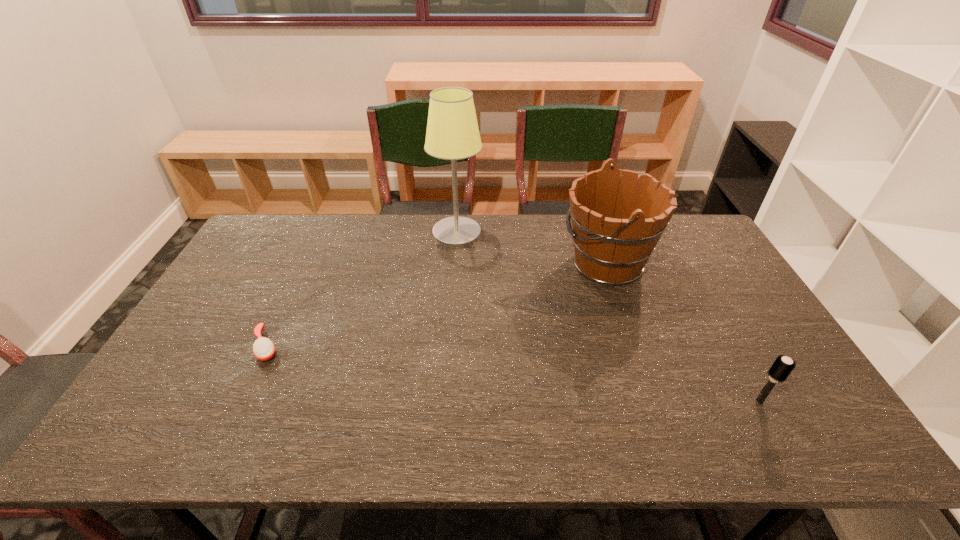
Where is `vacant space located 0.050m with the handle on the third object from left to right`? This screenshot has height=540, width=960. vacant space located 0.050m with the handle on the third object from left to right is located at coordinates tap(544, 263).

The width and height of the screenshot is (960, 540). I want to click on vacant space located 0.300m with the handle on the third object from left to right, so click(468, 263).

Find the location of a particular element. The height and width of the screenshot is (540, 960). vacant position located 0.200m on the left of the taller hairbrush is located at coordinates (667, 401).

Where is `vacant region located on the right of the shorter hairbrush`? vacant region located on the right of the shorter hairbrush is located at coordinates (427, 346).

Locate an element on the screen. The height and width of the screenshot is (540, 960). table lamp positioned at the far edge is located at coordinates (452, 133).

Locate an element on the screen. wine bucket that is positioned at the far edge is located at coordinates (616, 226).

The height and width of the screenshot is (540, 960). Identify the location of object located at the right edge. (782, 367).

In the image, there is a desktop. Where is `blank space at the far edge`? This screenshot has height=540, width=960. blank space at the far edge is located at coordinates (390, 224).

Where is `vacant space at the near edge of the desktop`? The height and width of the screenshot is (540, 960). vacant space at the near edge of the desktop is located at coordinates (375, 448).

Where is `vacant space at the left edge`? The image size is (960, 540). vacant space at the left edge is located at coordinates (208, 320).